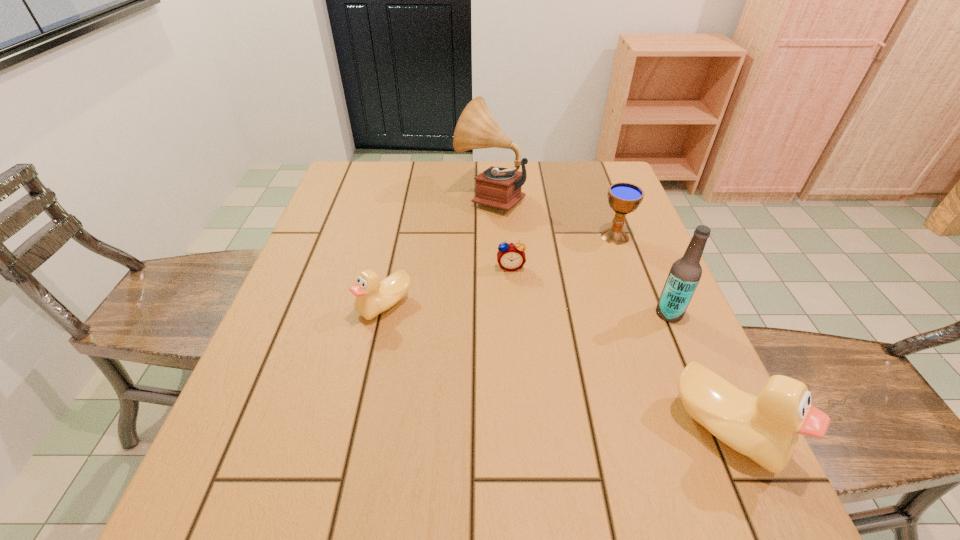
Where is `free space located on the front-facing side of the fourth nearest object`? Image resolution: width=960 pixels, height=540 pixels. free space located on the front-facing side of the fourth nearest object is located at coordinates click(x=515, y=315).

The height and width of the screenshot is (540, 960). What are the coordinates of `free location located on the back of the chalice` in the screenshot? It's located at (608, 216).

Locate an element on the screen. The height and width of the screenshot is (540, 960). object at the far edge is located at coordinates (497, 187).

Locate an element on the screen. object that is at the near edge is located at coordinates (766, 429).

You are a GUI agent. You are given a task and a screenshot of the screen. Output one action in this format:
    pyautogui.click(x=<x>, y=<y>)
    Task: Click on the duck at the right edge
    This screenshot has width=960, height=540.
    Given the screenshot: What is the action you would take?
    pyautogui.click(x=766, y=429)

This screenshot has width=960, height=540. What are the coordinates of `beer bottle at the right edge` in the screenshot? It's located at (685, 273).

Find the location of a particular element. The image size is (960, 540). chalice present at the right edge is located at coordinates (624, 198).

At what (x,y) coordinates should I click in order to perform the action: click on object at the near right corner. Please return your answer as a coordinate pair (x, y). Looking at the image, I should click on pos(766,429).

The width and height of the screenshot is (960, 540). I want to click on vacant space at the far edge of the desktop, so click(468, 189).

What are the coordinates of `free space at the near edge` in the screenshot? It's located at (368, 454).